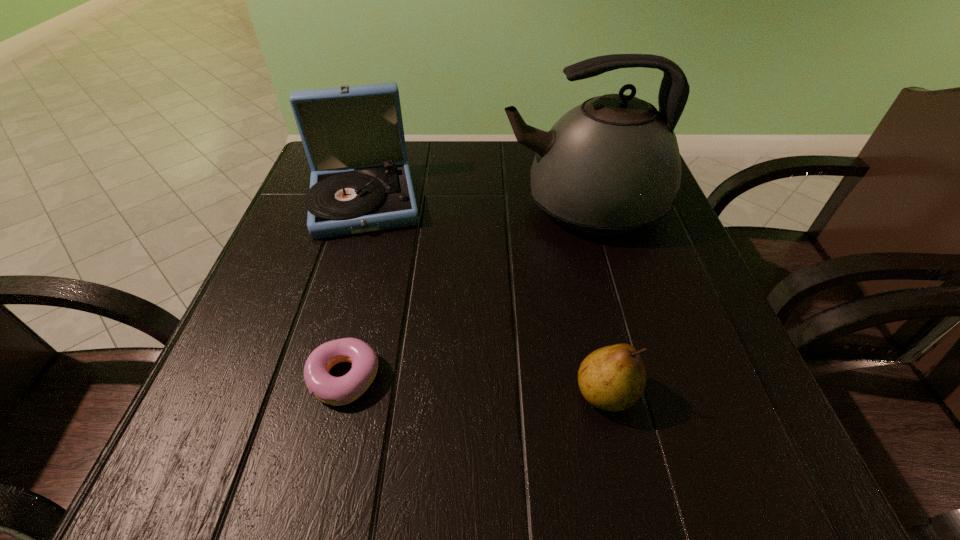
The height and width of the screenshot is (540, 960). In the image, there is a desktop. In order to click on vacant area at the right edge in this screenshot , I will do `click(644, 254)`.

Where is `vacant space at the near left corner of the desktop`? vacant space at the near left corner of the desktop is located at coordinates (255, 487).

You are a GUI agent. You are given a task and a screenshot of the screen. Output one action in this format:
    pyautogui.click(x=<x>, y=<y>)
    Task: Click on the free spot between the shortest object and the phonograph record
    
    Given the screenshot: What is the action you would take?
    pyautogui.click(x=354, y=288)

Where is `free area in between the pear and the doughnut`? free area in between the pear and the doughnut is located at coordinates (475, 385).

This screenshot has height=540, width=960. Identify the location of free space between the pear and the tallest object. (595, 300).

Image resolution: width=960 pixels, height=540 pixels. I want to click on free space that is in between the kettle and the pear, so click(x=595, y=300).

Identify the location of unoccupied area between the doughnut and the pear. The width and height of the screenshot is (960, 540). (475, 385).

Locate an element on the screen. Image resolution: width=960 pixels, height=540 pixels. vacant space in between the doughnut and the kettle is located at coordinates (464, 292).

This screenshot has width=960, height=540. What are the coordinates of `vacant region between the doughnut and the kettle` in the screenshot? It's located at (464, 292).

Locate an element on the screen. This screenshot has height=540, width=960. empty space between the second shortest object and the second tallest object is located at coordinates (485, 296).